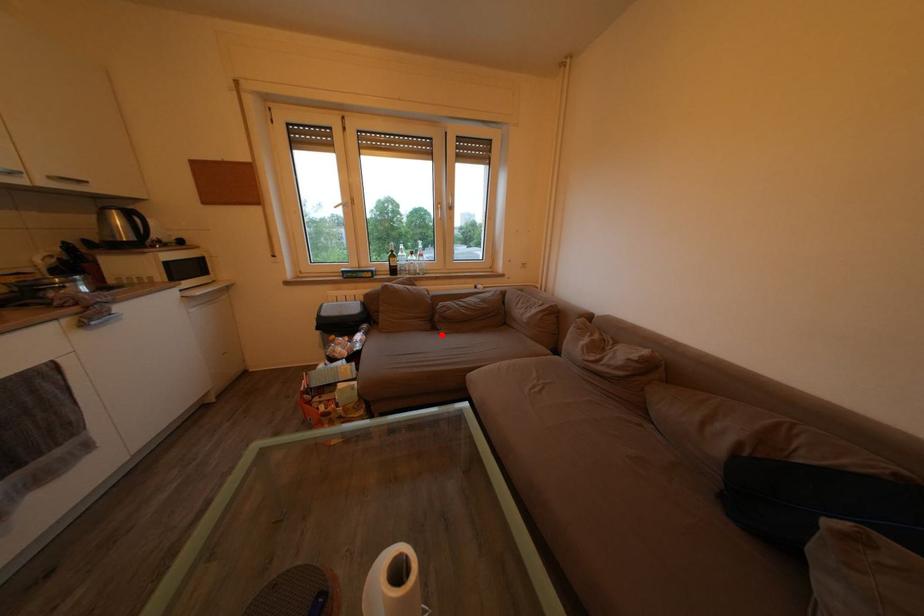
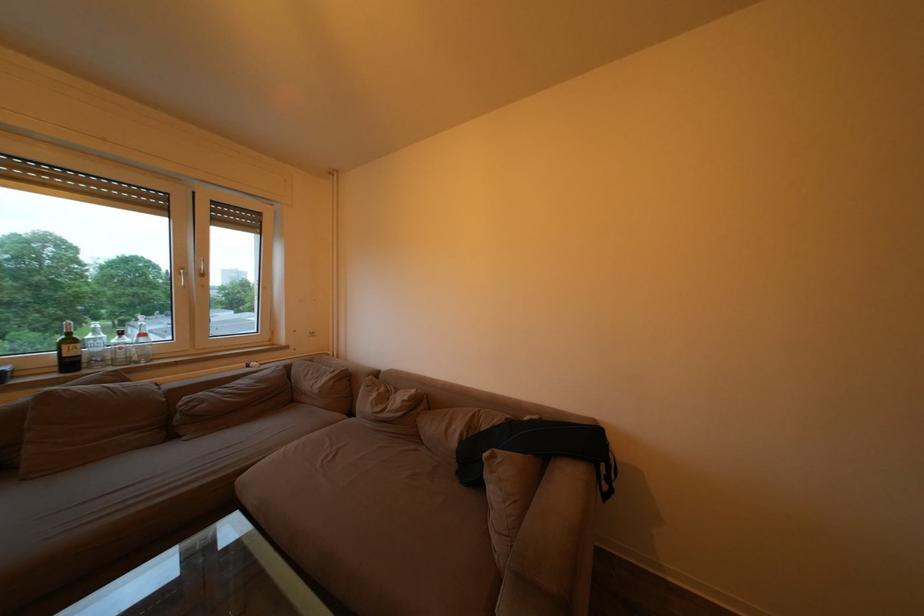
Locate, in the second image, the point that corresponds to the highlighted location in the first image.

(178, 443)